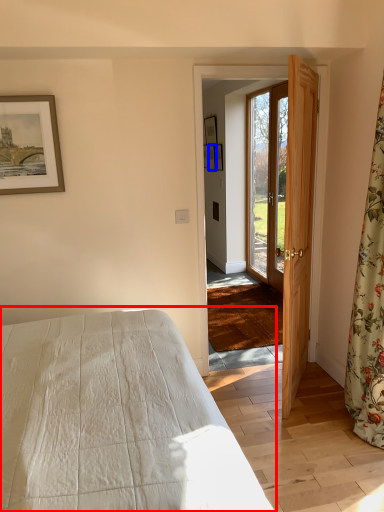
Question: Among these objects, which one is farthest to the camera, bed (highlighted by a red box) or picture frame (highlighted by a blue box)?

Choices:
 (A) bed
 (B) picture frame

Answer: (B)